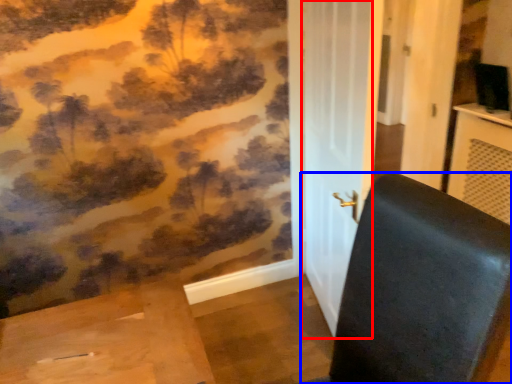
Question: Which object is closer to the camera taking this photo, screen door (highlighted by a red box) or furniture (highlighted by a blue box)?

Choices:
 (A) screen door
 (B) furniture

Answer: (B)